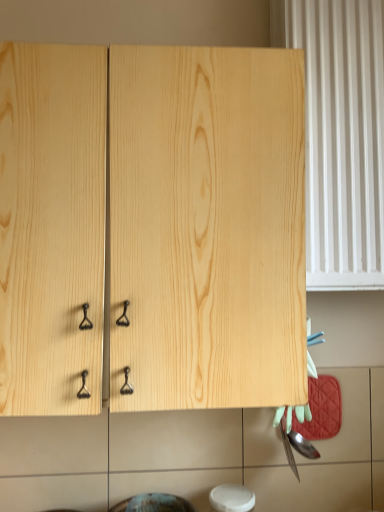
The image size is (384, 512). I want to click on natural wood cabinet at center, so click(x=207, y=228).

In order to face natural wood cabinet at center, should I rotate leftwards or rightwards?

Rotate your view left by about 7.751°.

What do you see at coordinates (207, 228) in the screenshot?
I see `natural wood cabinet at center` at bounding box center [207, 228].

Identify the location of white plastic radiator at right. The image size is (384, 512). (342, 138).

Describe the element at coordinates (342, 138) in the screenshot. I see `white plastic radiator at right` at that location.

Find the location of a particular element. The height and width of the screenshot is (512, 384). natural wood cabinet at center is located at coordinates (207, 228).

Is white plastic radiator at right at the right side of natural wood cabinet at center?

Correct, you'll find white plastic radiator at right to the right of natural wood cabinet at center.

Relative to natural wood cabinet at center, is white plastic radiator at right in front or behind?

white plastic radiator at right is behind natural wood cabinet at center.

Which is closer, (347, 210) or (294, 383)?

Point (347, 210) is farther from the camera than point (294, 383).

From the image's perspective, relative to natural wood cabinet at center, is white plastic radiator at right above or below?

Clearly, from the image's perspective, white plastic radiator at right is above natural wood cabinet at center.

From a real-world perspective, is white plastic radiator at right beneath natural wood cabinet at center?

Actually, white plastic radiator at right is physically above natural wood cabinet at center in the real world.

Considering the relative sizes of white plastic radiator at right and natural wood cabinet at center in the image provided, is white plastic radiator at right thinner than natural wood cabinet at center?

Yes, white plastic radiator at right is thinner than natural wood cabinet at center.

In terms of height, does white plastic radiator at right look taller or shorter compared to natural wood cabinet at center?

Clearly, white plastic radiator at right is taller compared to natural wood cabinet at center.

Who is bigger, white plastic radiator at right or natural wood cabinet at center?

Bigger between the two is natural wood cabinet at center.

In the scene shown: Is natural wood cabinet at center completely or partially inside white plastic radiator at right?

No, natural wood cabinet at center is not a part of white plastic radiator at right.

Is white plastic radiator at right positioned far away from natural wood cabinet at center?

No, white plastic radiator at right is not far away from natural wood cabinet at center.

Is white plastic radiator at right oriented towards natural wood cabinet at center?

No.

How many degrees apart are the facing directions of white plastic radiator at right and natural wood cabinet at center?

The angle between the facing direction of white plastic radiator at right and the facing direction of natural wood cabinet at center is 0.289 degrees.

How much distance is there between white plastic radiator at right and natural wood cabinet at center?

33.95 centimeters.

Identify the location of cabinetry lying below the white plastic radiator at right (from the image's perspective). point(207,228).

Would you say natural wood cabinet at center is to the left or to the right of white plastic radiator at right in the picture?

Based on their positions, natural wood cabinet at center is located to the left of white plastic radiator at right.

Is the position of natural wood cabinet at center more distant than that of white plastic radiator at right?

No, natural wood cabinet at center is in front of white plastic radiator at right.

Which is in front, point (301, 319) or point (352, 221)?

The point (301, 319) is closer to the camera.

From the image's perspective, between natural wood cabinet at center and white plastic radiator at right, which one is located above?

From the image's view, white plastic radiator at right is above.

From a real-world perspective, is natural wood cabinet at center on white plastic radiator at right?

Actually, natural wood cabinet at center is physically below white plastic radiator at right in the real world.

Considering the relative sizes of natural wood cabinet at center and white plastic radiator at right in the image provided, is natural wood cabinet at center wider than white plastic radiator at right?

Yes, natural wood cabinet at center is wider than white plastic radiator at right.

Between natural wood cabinet at center and white plastic radiator at right, which one has more height?

Standing taller between the two is white plastic radiator at right.

Based on their sizes in the image, would you say natural wood cabinet at center is bigger or smaller than white plastic radiator at right?

natural wood cabinet at center is bigger than white plastic radiator at right.

Would you say white plastic radiator at right is part of natural wood cabinet at center's contents?

No, natural wood cabinet at center does not contain white plastic radiator at right.

Are natural wood cabinet at center and white plastic radiator at right far apart?

No, there isn't a large distance between natural wood cabinet at center and white plastic radiator at right.

Does natural wood cabinet at center turn towards white plastic radiator at right?

No.

How different are the orientations of natural wood cabinet at center and white plastic radiator at right in degrees?

natural wood cabinet at center and white plastic radiator at right are facing 0.289 degrees away from each other.

Identify the location of curtain above the natural wood cabinet at center (from the image's perspective). (342, 138).

Identify the location of cabinetry on the left side of white plastic radiator at right. (207, 228).

Where is `curtain behind the natural wood cabinet at center`? curtain behind the natural wood cabinet at center is located at coordinates (342, 138).